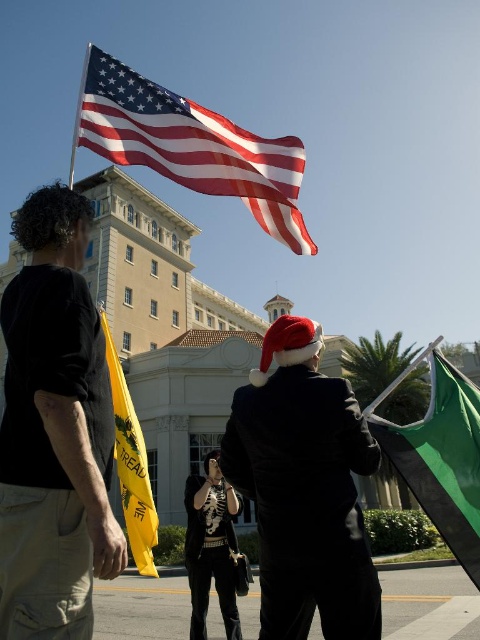
Is bright red fabric flag at upper center below green fabric flag at right?

No.

Between point (207, 170) and point (433, 467), which one is positioned behind?

The point (207, 170) is more distant.

Where is `bright red fabric flag at upper center`? bright red fabric flag at upper center is located at coordinates (190, 145).

Is matte black suit at center smaller than yellow fabric flag at lower left?

Yes.

Does matte black suit at center have a greater width compared to yellow fabric flag at lower left?

Incorrect, matte black suit at center's width does not surpass yellow fabric flag at lower left's.

Where is `matte black suit at center`? matte black suit at center is located at coordinates (304, 488).

Is green fabric flag at right behind yellow fabric flag at lower left?

No, it is not.

What do you see at coordinates (440, 454) in the screenshot? This screenshot has height=640, width=480. I see `green fabric flag at right` at bounding box center [440, 454].

I want to click on green fabric flag at right, so click(440, 454).